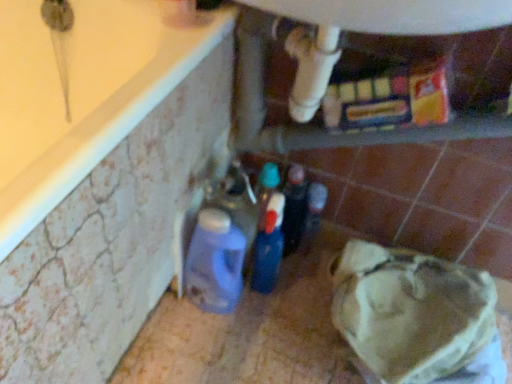
The height and width of the screenshot is (384, 512). Identify the location of unoccupied region to the right of matte plastic detergent at lower left, positioned as the 1th bottle in left-to-right order. (284, 319).